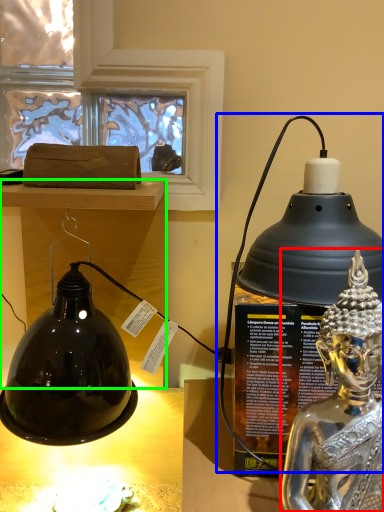
Question: Based on their relative distances, which object is farther from person (highlighted by a red box)? Choose from oil lamp (highlighted by a blue box) and furniture (highlighted by a green box).

Choices:
 (A) oil lamp
 (B) furniture

Answer: (B)